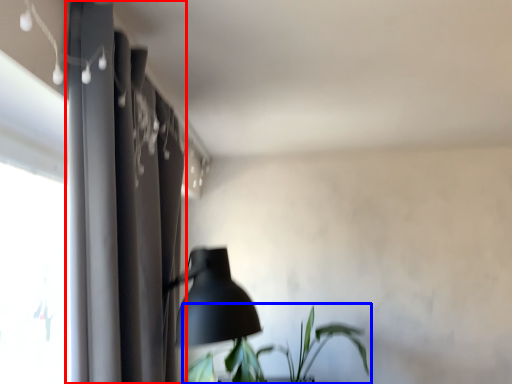
Question: Among these objects, which one is nearest to the camera, curtain (highlighted by a red box) or houseplant (highlighted by a blue box)?

Choices:
 (A) curtain
 (B) houseplant

Answer: (A)